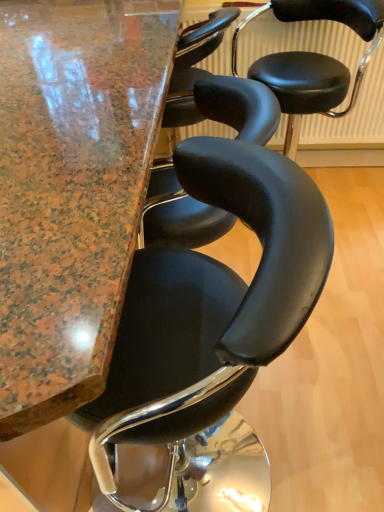
Question: Based on their sizes in the image, would you say marble table at center is bigger or smaller than black leather chair at center, positioned as the second chair in back-to-front order?

Choices:
 (A) small
 (B) big

Answer: (B)

Question: In terms of width, does marble table at center look wider or thinner when compared to black leather chair at center, which is counted as the 1th chair, starting from the bottom?

Choices:
 (A) thin
 (B) wide

Answer: (B)

Question: Estimate the real-world distances between objects in this image. Which object is closer to the marble table at center?

Choices:
 (A) black leather chair at center, positioned as the second chair in back-to-front order
 (B) black leather stool at center, placed as the first chair when sorted from top to bottom

Answer: (A)

Question: Based on their relative distances, which object is nearer to the black leather stool at center, placed as the first chair when sorted from top to bottom?

Choices:
 (A) black leather chair at center, positioned as the second chair in back-to-front order
 (B) marble table at center

Answer: (B)